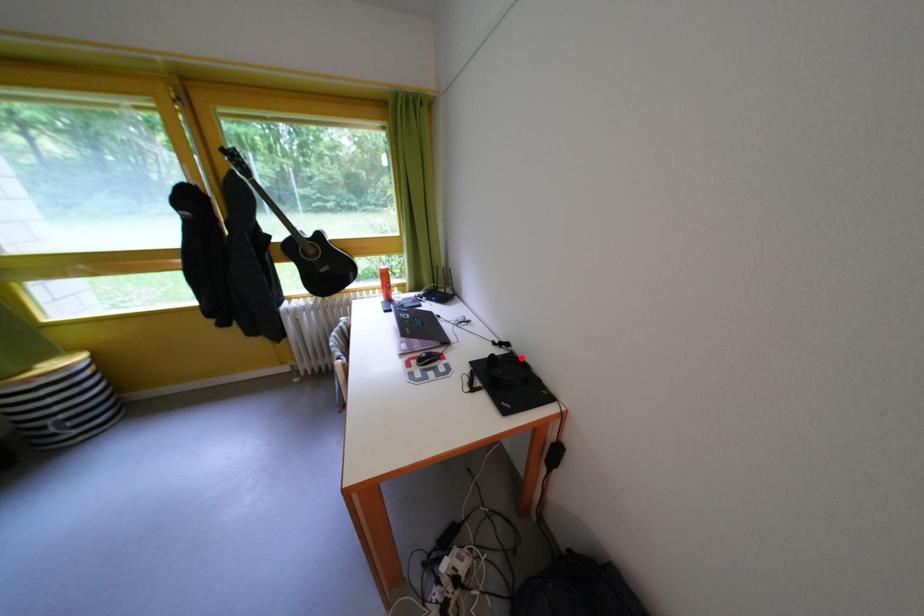
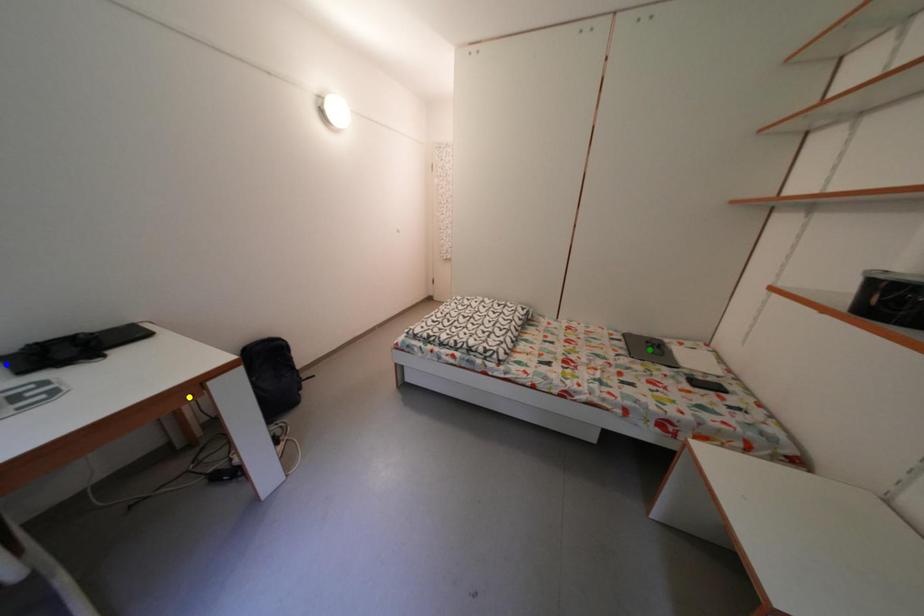
Question: I am providing you with two images of the same scene from different viewpoints. A red point is marked on the first image. You are given multiple points on the second image. Which mark in image 2 goes with the point in image 1?

Choices:
 (A) green point
 (B) blue point
 (C) yellow point

Answer: (B)